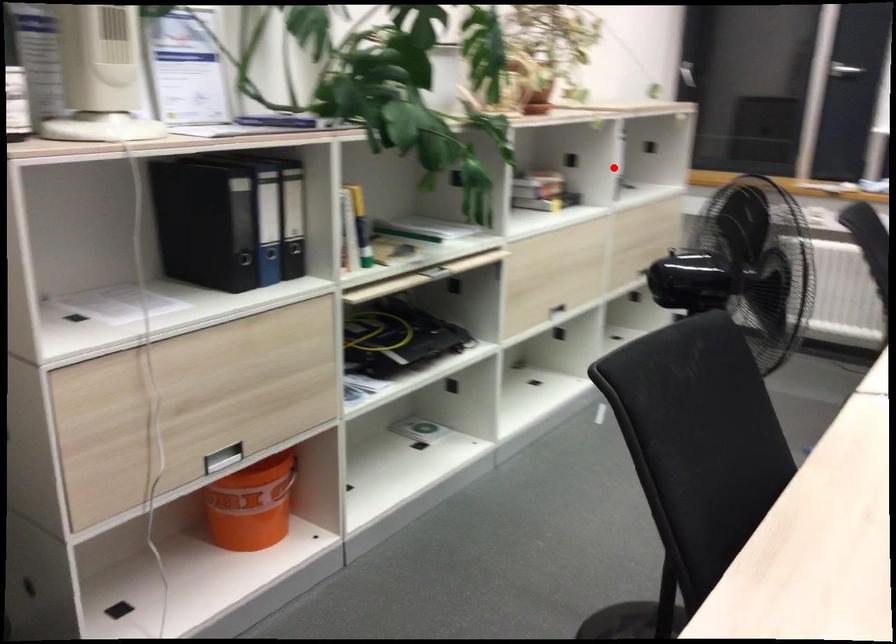
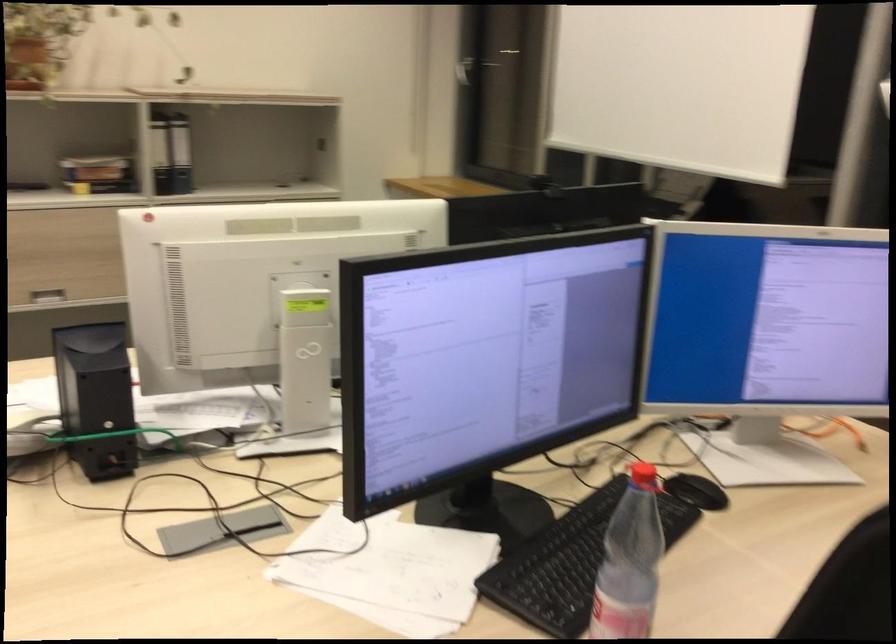
Question: I am providing you with two images of the same scene from different viewpoints. A red point is marked on the first image. At the location where the point appears in image 1, is it still visible in image 2?

Choices:
 (A) Yes
 (B) No

Answer: (A)